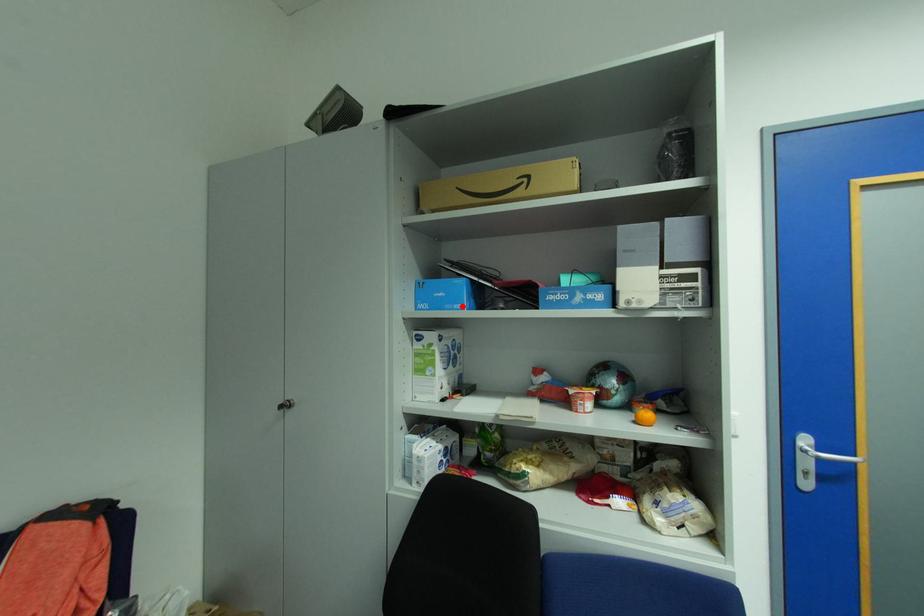
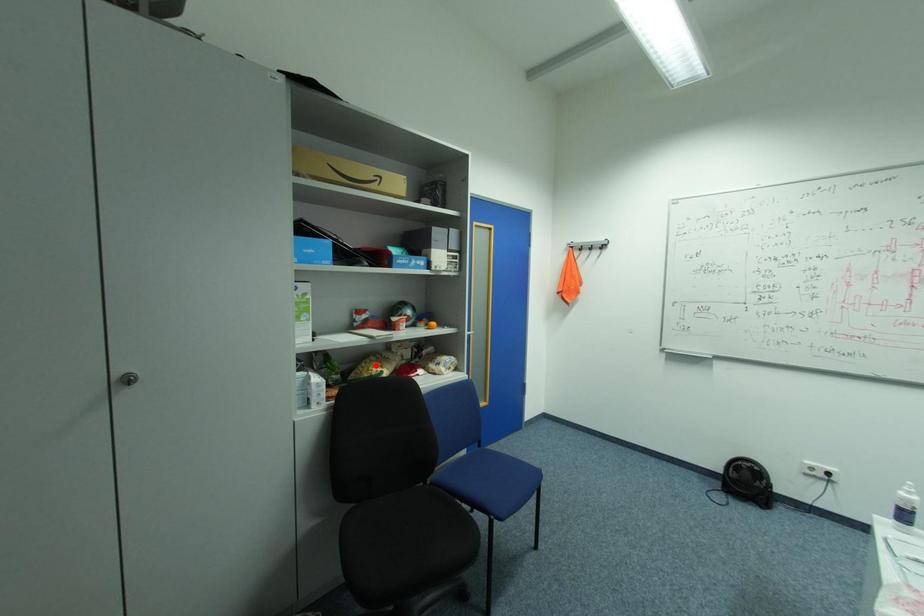
I am providing you with two images of the same scene from different viewpoints. A red point is marked on the first image and another point is marked on the second image. Is the marked point in image1 the same physical position as the marked point in image2?

No